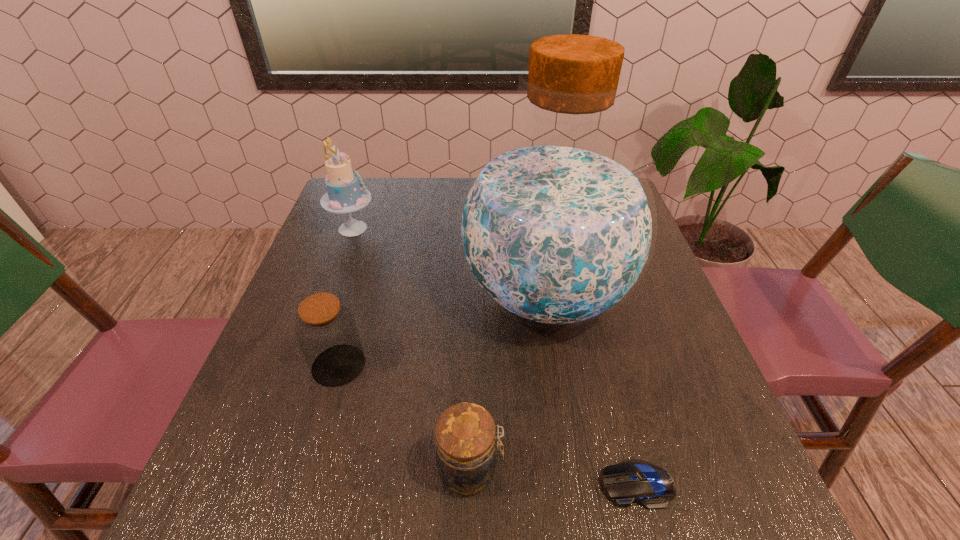
Where is `water jug located at the right edge`? Image resolution: width=960 pixels, height=540 pixels. water jug located at the right edge is located at coordinates (556, 228).

The height and width of the screenshot is (540, 960). I want to click on computer mouse that is at the right edge, so click(631, 481).

Where is `object that is at the far left corner`? This screenshot has width=960, height=540. object that is at the far left corner is located at coordinates (345, 194).

You are a GUI agent. You are given a task and a screenshot of the screen. Output one action in this format:
    pyautogui.click(x=<x>, y=<y>)
    Task: Click on the object located at the near right corner
    Image resolution: width=960 pixels, height=540 pixels.
    Given the screenshot: What is the action you would take?
    pyautogui.click(x=631, y=481)

Identify the location of vacant position at the far edge of the desktop. tap(418, 214).

Where is `vacant space at the near edge of the desktop`? The image size is (960, 540). vacant space at the near edge of the desktop is located at coordinates (523, 532).

In the image, there is a desktop. At what (x,y) coordinates should I click in order to perform the action: click on blank space at the left edge. Please return your answer as a coordinate pair (x, y). The image size is (960, 540). Looking at the image, I should click on (367, 239).

Where is `free location at the right edge`? The width and height of the screenshot is (960, 540). free location at the right edge is located at coordinates (646, 313).

Identify the location of vacant area that lies between the taller jar and the water jug. The height and width of the screenshot is (540, 960). (442, 330).

The width and height of the screenshot is (960, 540). In order to click on empty location between the second shortest object and the water jug in this screenshot , I will do `click(508, 382)`.